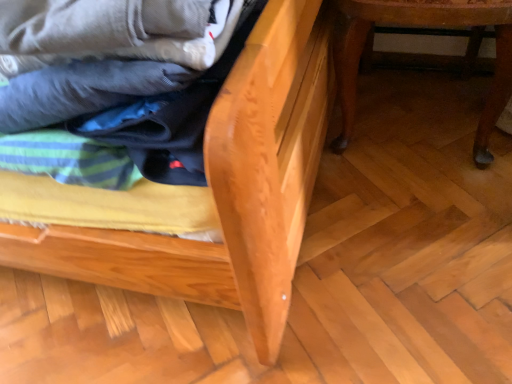
Question: Is matte cotton laundry at center looking in the opposite direction of natural wood bed frame at center, which is the 2th furniture in right-to-left order?

Choices:
 (A) no
 (B) yes

Answer: (B)

Question: Considering the relative sizes of matte cotton laundry at center and natural wood bed frame at center, positioned as the 1th furniture in left-to-right order, in the image provided, is matte cotton laundry at center bigger than natural wood bed frame at center, positioned as the 1th furniture in left-to-right order,?

Choices:
 (A) yes
 (B) no

Answer: (B)

Question: From a real-world perspective, is matte cotton laundry at center under natural wood bed frame at center, positioned as the 1th furniture in left-to-right order?

Choices:
 (A) yes
 (B) no

Answer: (B)

Question: From the image's perspective, is matte cotton laundry at center under natural wood bed frame at center, which is the 2th furniture in right-to-left order?

Choices:
 (A) yes
 (B) no

Answer: (A)

Question: Can you confirm if matte cotton laundry at center is taller than natural wood bed frame at center, which is the 2th furniture in right-to-left order?

Choices:
 (A) yes
 (B) no

Answer: (B)

Question: Considering the positions of point (222, 271) and point (364, 29), is point (222, 271) closer or farther from the camera than point (364, 29)?

Choices:
 (A) farther
 (B) closer

Answer: (B)

Question: In the image, is natural wood bed frame at center, positioned as the 1th furniture in left-to-right order, positioned in front of or behind wooden table at lower right, which ranks as the second furniture in left-to-right order?

Choices:
 (A) front
 (B) behind

Answer: (A)

Question: In terms of size, does natural wood bed frame at center, positioned as the 1th furniture in left-to-right order, appear bigger or smaller than wooden table at lower right, which ranks as the second furniture in left-to-right order?

Choices:
 (A) small
 (B) big

Answer: (B)

Question: Is natural wood bed frame at center, which is the 2th furniture in right-to-left order, taller or shorter than wooden table at lower right, arranged as the 1th furniture when viewed from the right?

Choices:
 (A) short
 (B) tall

Answer: (B)

Question: In the image, is natural wood bed frame at center, which is the 2th furniture in right-to-left order, positioned in front of or behind matte cotton laundry at center?

Choices:
 (A) front
 (B) behind

Answer: (A)

Question: From the image's perspective, is natural wood bed frame at center, positioned as the 1th furniture in left-to-right order, located above or below matte cotton laundry at center?

Choices:
 (A) below
 (B) above

Answer: (B)

Question: Is point (317, 125) positioned closer to the camera than point (100, 135)?

Choices:
 (A) closer
 (B) farther

Answer: (B)

Question: Is natural wood bed frame at center, positioned as the 1th furniture in left-to-right order, taller or shorter than matte cotton laundry at center?

Choices:
 (A) tall
 (B) short

Answer: (A)

Question: From a real-world perspective, relative to matte cotton laundry at center, is wooden table at lower right, arranged as the 1th furniture when viewed from the right, vertically above or below?

Choices:
 (A) above
 (B) below

Answer: (B)

Question: Is point (352, 29) positioned closer to the camera than point (74, 125)?

Choices:
 (A) closer
 (B) farther

Answer: (B)